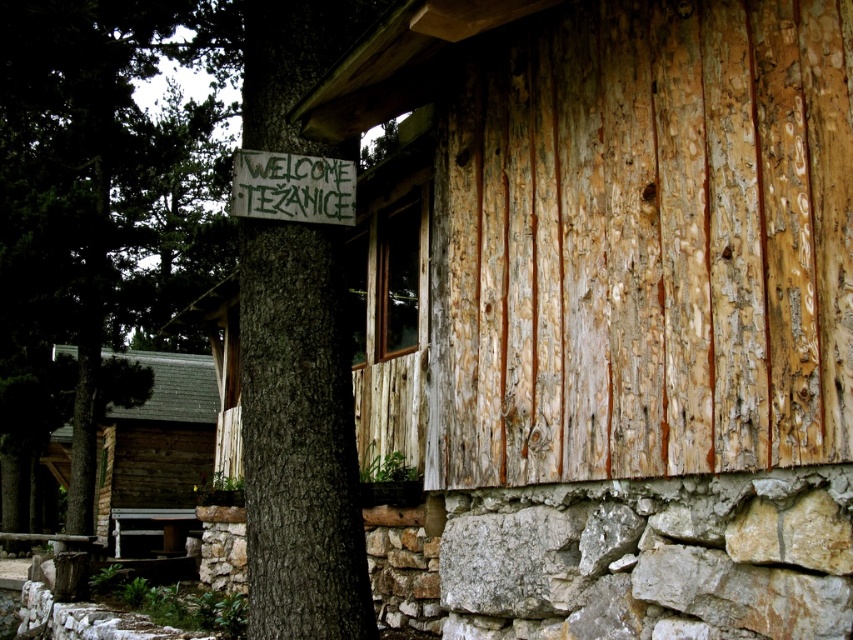
In the scene shown: How much distance is there between green rough bark tree at left and brown wooden log cabin at left?

A distance of 7.90 feet exists between green rough bark tree at left and brown wooden log cabin at left.

Between green rough bark tree at left and brown wooden log cabin at left, which one appears on the left side from the viewer's perspective?

Positioned to the left is brown wooden log cabin at left.

This screenshot has width=853, height=640. Describe the element at coordinates (100, 221) in the screenshot. I see `green rough bark tree at left` at that location.

In order to click on green rough bark tree at left in this screenshot , I will do `click(100, 221)`.

Who is lower down, brown rough bark tree at left or green painted wood sign at upper center?

brown rough bark tree at left is lower down.

Can you confirm if brown rough bark tree at left is smaller than green painted wood sign at upper center?

Actually, brown rough bark tree at left might be larger than green painted wood sign at upper center.

Between point (322, 525) and point (329, 188), which one is positioned in front?

Positioned in front is point (322, 525).

The image size is (853, 640). What are the coordinates of `brown rough bark tree at left` in the screenshot? It's located at (299, 436).

Does brown rough bark tree at left appear on the left side of brown wooden log cabin at left?

In fact, brown rough bark tree at left is to the right of brown wooden log cabin at left.

Can you confirm if brown rough bark tree at left is wider than brown wooden log cabin at left?

Incorrect, brown rough bark tree at left's width does not surpass brown wooden log cabin at left's.

Locate an element on the screen. The height and width of the screenshot is (640, 853). brown rough bark tree at left is located at coordinates (299, 436).